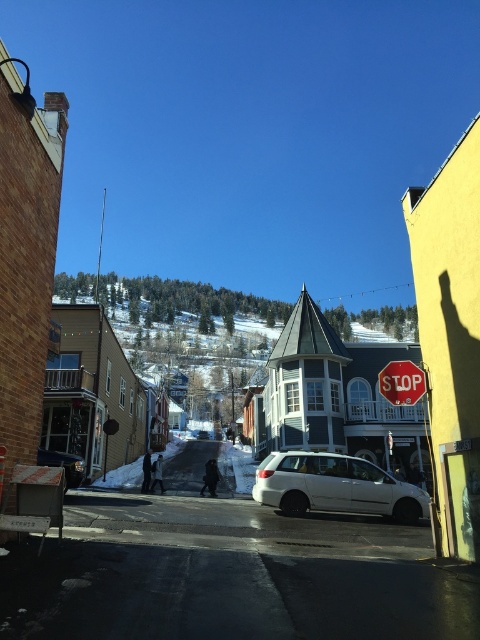
Is white matte van at center below red matte stop sign at lower right?

Correct, white matte van at center is located below red matte stop sign at lower right.

Measure the distance between white matte van at center and red matte stop sign at lower right.

white matte van at center is 5.78 meters from red matte stop sign at lower right.

You are a GUI agent. You are given a task and a screenshot of the screen. Output one action in this format:
    pyautogui.click(x=<x>, y=<y>)
    Task: Click on the white matte van at center
    
    Given the screenshot: What is the action you would take?
    pyautogui.click(x=335, y=486)

At what (x,y) coordinates should I click in order to perform the action: click on white matte van at center. Please return your answer as a coordinate pair (x, y). This screenshot has height=640, width=480. Looking at the image, I should click on (335, 486).

Is white matte building at center bigger than white matte van at center?

Indeed, white matte building at center has a larger size compared to white matte van at center.

Describe the element at coordinates (336, 397) in the screenshot. I see `white matte building at center` at that location.

Between point (402, 460) and point (348, 509), which one is positioned behind?

The point (402, 460) is more distant.

Image resolution: width=480 pixels, height=640 pixels. Identify the location of white matte building at center. (336, 397).

Looking at this image, is white matte building at center taller than red matte stop sign at lower right?

Yes, white matte building at center is taller than red matte stop sign at lower right.

From the picture: Between white matte building at center and red matte stop sign at lower right, which one has more height?

white matte building at center

I want to click on white matte building at center, so click(336, 397).